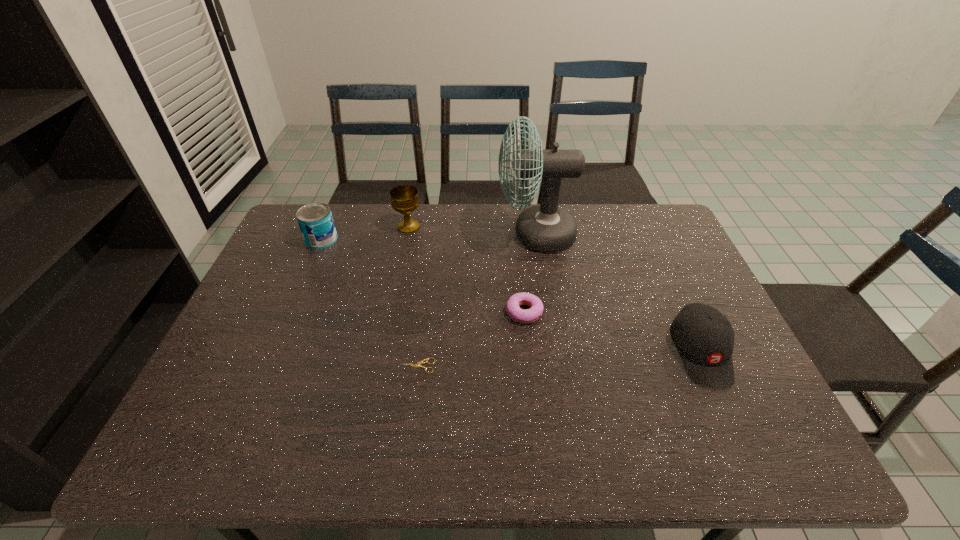
Where is `free spot located 0.080m on the right of the leftmost object`? free spot located 0.080m on the right of the leftmost object is located at coordinates (362, 240).

In order to click on vacant space located 0.130m with a logo on the front of the rightmost object in this screenshot , I will do `click(740, 443)`.

In order to click on vacant space located on the left of the second shortest object in this screenshot , I will do `click(394, 313)`.

The height and width of the screenshot is (540, 960). Find the location of `blank area located 0.250m on the back of the shears`. blank area located 0.250m on the back of the shears is located at coordinates (426, 288).

Locate an element on the screen. fan that is at the far edge is located at coordinates (546, 228).

Identify the location of chalice positioned at the far edge. This screenshot has height=540, width=960. (404, 199).

Locate an element on the screen. The height and width of the screenshot is (540, 960). can that is positioned at the far edge is located at coordinates point(315,220).

I want to click on object located at the left edge, so click(x=315, y=220).

You are a GUI agent. You are given a task and a screenshot of the screen. Output one action in this format:
    pyautogui.click(x=<x>, y=<y>)
    Task: Click on the object located at the right edge
    The width and height of the screenshot is (960, 540).
    Given the screenshot: What is the action you would take?
    pyautogui.click(x=704, y=338)

This screenshot has width=960, height=540. What are the coordinates of `object positioned at the far left corner` in the screenshot? It's located at (315, 220).